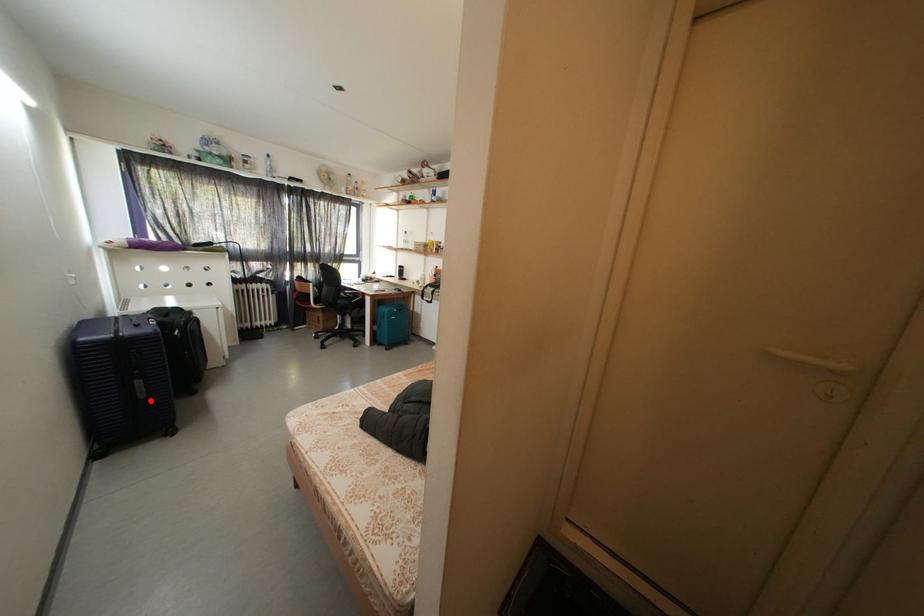
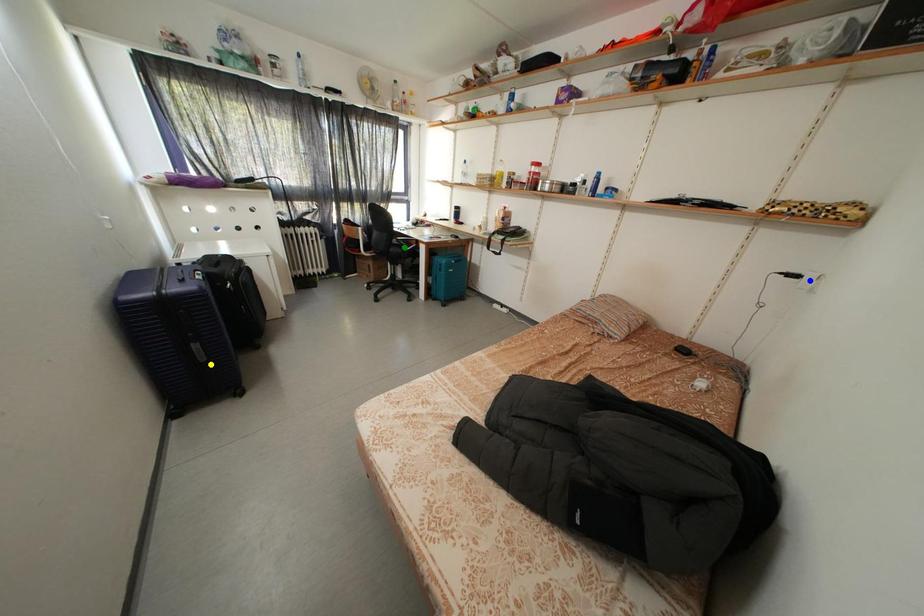
Question: I am providing you with two images of the same scene from different viewpoints. A red point is marked on the first image. You are given multiple points on the second image. Which point in image 2 is actually the same real-world point as the red point in image 1?

Choices:
 (A) blue point
 (B) yellow point
 (C) green point

Answer: (B)